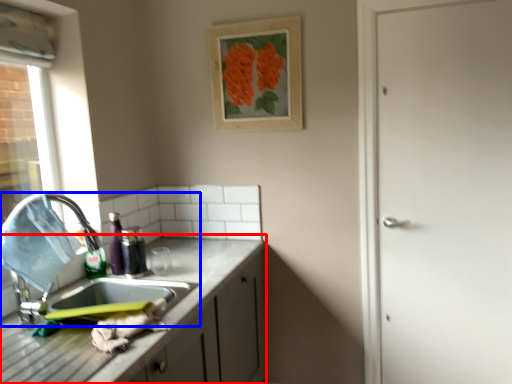
Question: Which object is further to the camera taking this photo, cabinetry (highlighted by a red box) or sink (highlighted by a blue box)?

Choices:
 (A) cabinetry
 (B) sink

Answer: (B)